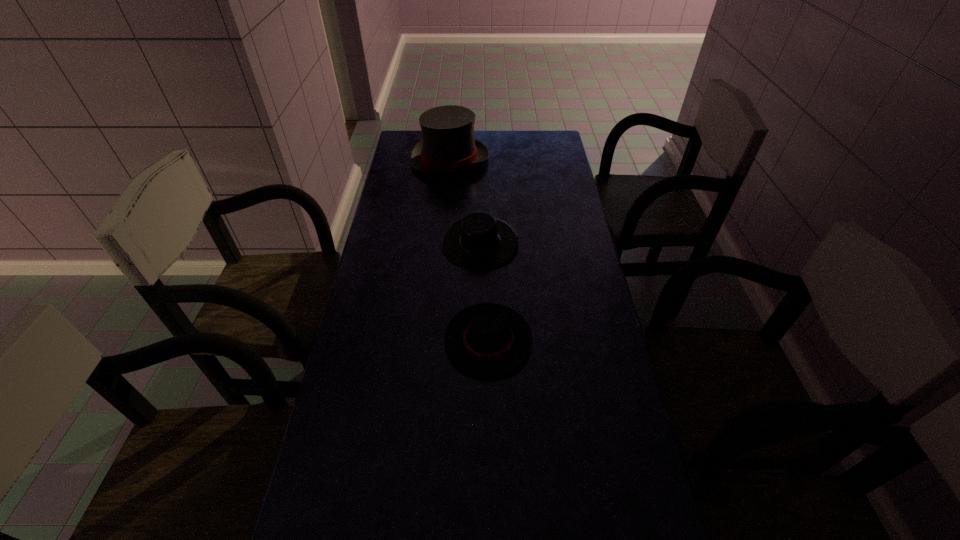
The height and width of the screenshot is (540, 960). Identify the location of the tallest dress hat. (448, 145).

In order to click on the farthest dress hat in this screenshot , I will do `click(448, 145)`.

Image resolution: width=960 pixels, height=540 pixels. In order to click on the second nearest dress hat in this screenshot , I will do `click(479, 242)`.

Locate an element on the screen. The image size is (960, 540). the shortest dress hat is located at coordinates (488, 339).

Where is `the third farthest object`? The height and width of the screenshot is (540, 960). the third farthest object is located at coordinates (488, 339).

Find the location of a particular element. The height and width of the screenshot is (540, 960). vacant space situated 0.110m on the right of the farthest dress hat is located at coordinates (515, 160).

Where is `vacant space located on the right of the second nearest dress hat`? The height and width of the screenshot is (540, 960). vacant space located on the right of the second nearest dress hat is located at coordinates (557, 244).

Image resolution: width=960 pixels, height=540 pixels. What are the coordinates of `free spot located 0.170m on the left of the shortest dress hat` in the screenshot? It's located at (384, 341).

The image size is (960, 540). Find the location of `object positioned at the far edge`. object positioned at the far edge is located at coordinates (448, 145).

Identify the location of object that is at the left edge. Image resolution: width=960 pixels, height=540 pixels. (448, 145).